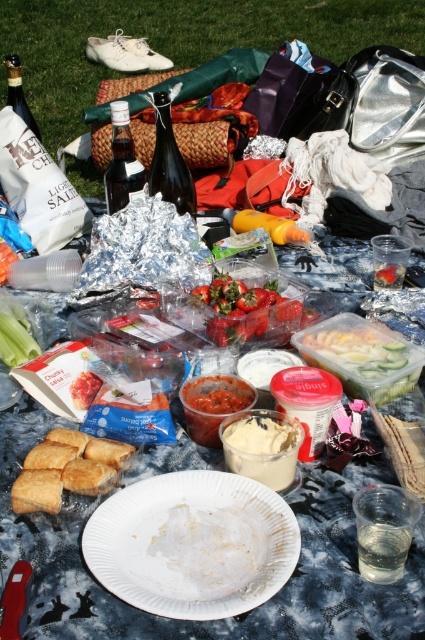
Between point (246, 518) and point (130, 195), which one is positioned behind?

The point (130, 195) is behind.

Can you confirm if white paper plate at center is positioned to the right of translucent glass bottle at center?

Correct, you'll find white paper plate at center to the right of translucent glass bottle at center.

The height and width of the screenshot is (640, 425). I want to click on white paper plate at center, so click(192, 545).

Between point (289, 420) and point (25, 108), which one is positioned behind?

The point (25, 108) is more distant.

Is point (295, 433) less distant than point (36, 134)?

Yes, it is in front of point (36, 134).

What are the coordinates of `white creamy spread at center` in the screenshot? It's located at (261, 445).

Is shiny red strawberries at center to the right of translucent plastic container at center from the viewer's perspective?

In fact, shiny red strawberries at center is to the left of translucent plastic container at center.

The height and width of the screenshot is (640, 425). What do you see at coordinates (251, 308) in the screenshot?
I see `shiny red strawberries at center` at bounding box center [251, 308].

Find the location of `shiny red strawberries at center`. shiny red strawberries at center is located at coordinates (251, 308).